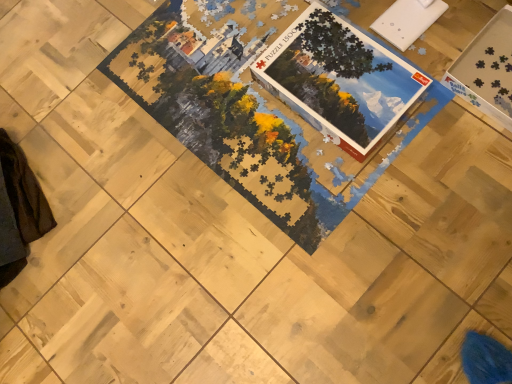
Question: From a real-world perspective, is white cardboard puzzle pieces at upper right physically located above or below matte cardboard puzzle box at center?

Choices:
 (A) above
 (B) below

Answer: (B)

Question: Is white cardboard puzzle pieces at upper right inside the boundaries of matte cardboard puzzle box at center, or outside?

Choices:
 (A) outside
 (B) inside

Answer: (A)

Question: Relative to matte cardboard puzzle box at center, is white cardboard puzzle pieces at upper right in front or behind?

Choices:
 (A) front
 (B) behind

Answer: (A)

Question: Relative to white cardboard puzzle pieces at upper right, is matte cardboard puzzle box at center in front or behind?

Choices:
 (A) behind
 (B) front

Answer: (A)

Question: Is matte cardboard puzzle box at center wider or thinner than white cardboard puzzle pieces at upper right?

Choices:
 (A) wide
 (B) thin

Answer: (B)

Question: From a real-world perspective, is matte cardboard puzzle box at center positioned above or below white cardboard puzzle pieces at upper right?

Choices:
 (A) above
 (B) below

Answer: (A)

Question: From the image's perspective, is matte cardboard puzzle box at center positioned above or below white cardboard puzzle pieces at upper right?

Choices:
 (A) above
 (B) below

Answer: (B)